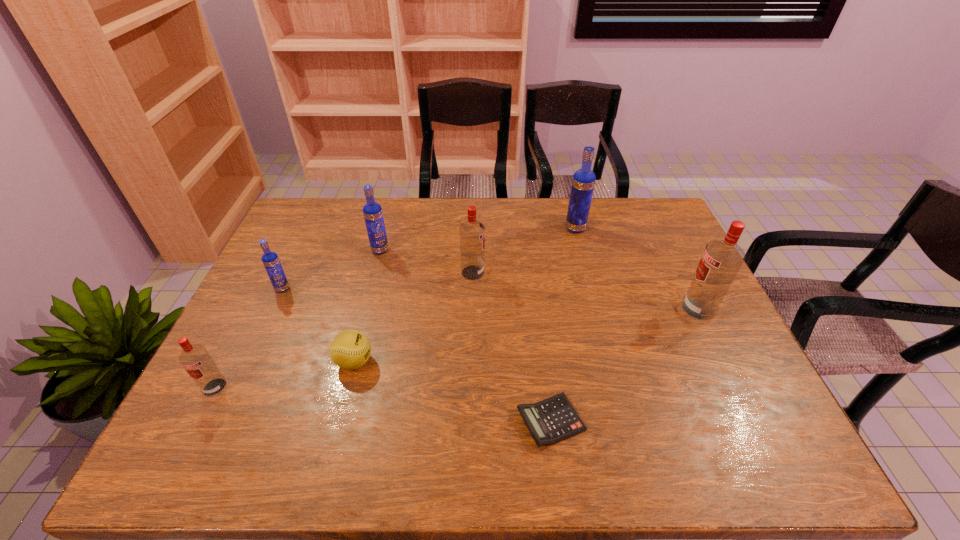
You are a GUI agent. You are given a task and a screenshot of the screen. Output one action in this format:
    pyautogui.click(x=<x>, y=<y>)
    Task: Click on the red vodka object that ranks as the closest to the nearest vodka
    The width and height of the screenshot is (960, 540).
    Given the screenshot: What is the action you would take?
    pyautogui.click(x=472, y=232)

Select which red vodka is the second closest to the farthest red vodka. Please provide its 2D coordinates. Your answer should be formatted as a tuple, i.e. [(x, y)], where the tuple contains the x and y coordinates of a point satisfying the conditions above.

[(195, 359)]

The image size is (960, 540). I want to click on free location that satisfies the following two spatial constraints: 1. on the front label of the farthest red vodka; 2. on the front side of the smallest blue vodka, so click(x=472, y=288).

You are a GUI agent. You are given a task and a screenshot of the screen. Output one action in this format:
    pyautogui.click(x=<x>, y=<y>)
    Task: Click on the vacant space that satisfies the following two spatial constraints: 1. on the front side of the seventh object from left to right; 2. on the front label of the second smallest red vodka
    Image resolution: width=960 pixels, height=540 pixels.
    Given the screenshot: What is the action you would take?
    pyautogui.click(x=587, y=273)

Where is `vacant position in the image that satisfies the following two spatial constraints: 1. on the back side of the fifth nearest vodka; 2. on the left side of the leftmost blue vodka`? vacant position in the image that satisfies the following two spatial constraints: 1. on the back side of the fifth nearest vodka; 2. on the left side of the leftmost blue vodka is located at coordinates (300, 250).

I want to click on blank area in the image that satisfies the following two spatial constraints: 1. on the back side of the second farthest object; 2. on the left side of the nearest blue vodka, so click(300, 250).

Where is `free space that satisfies the following two spatial constraints: 1. on the logo side of the softball; 2. on the back side of the third object from right to left`? free space that satisfies the following two spatial constraints: 1. on the logo side of the softball; 2. on the back side of the third object from right to left is located at coordinates pos(339,422).